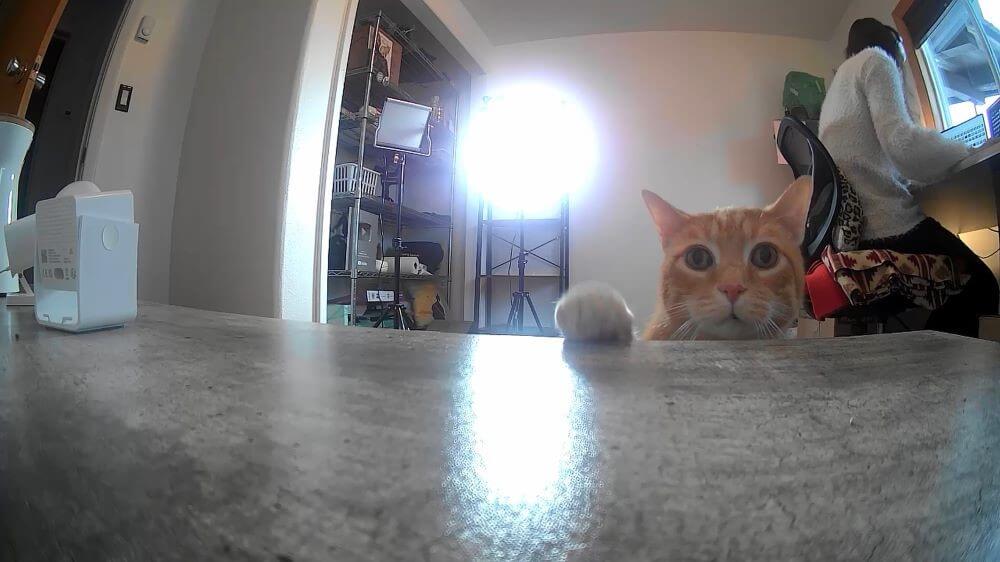
At what (x,y) coordinates should I click in order to perform the action: click on windows. Please return your answer as a coordinate pair (x, y). The width and height of the screenshot is (1000, 562). Looking at the image, I should click on (521, 146), (963, 67).